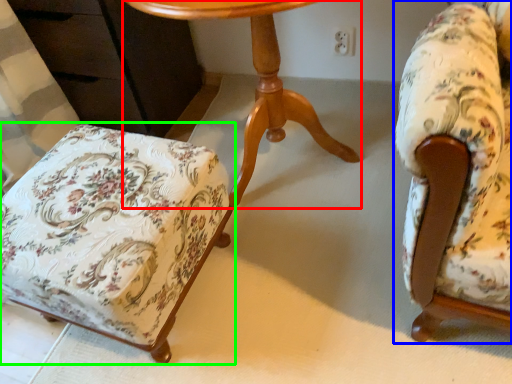
Question: Which is farther away from table (highlighted by a red box)? chair (highlighted by a blue box) or chair (highlighted by a green box)?

Choices:
 (A) chair
 (B) chair

Answer: (A)